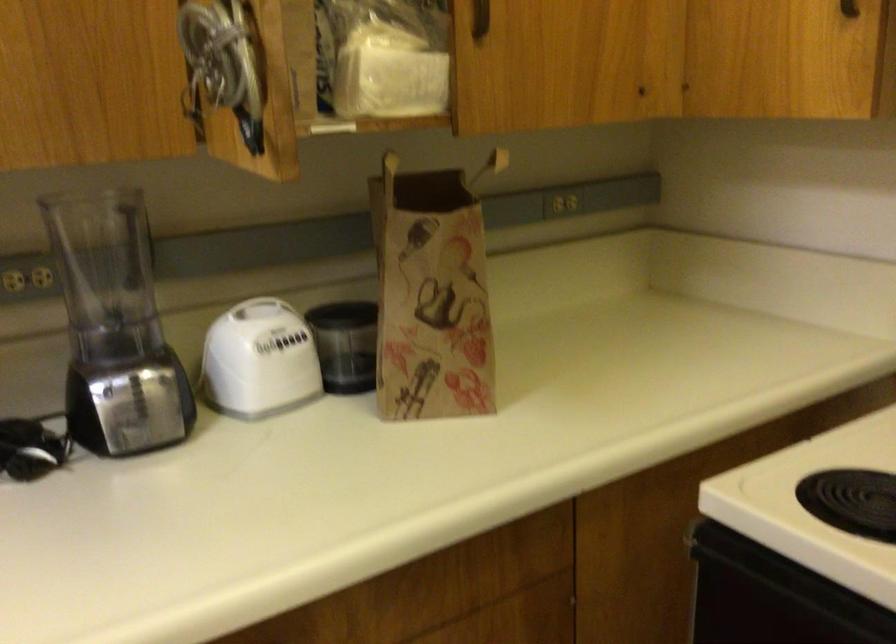
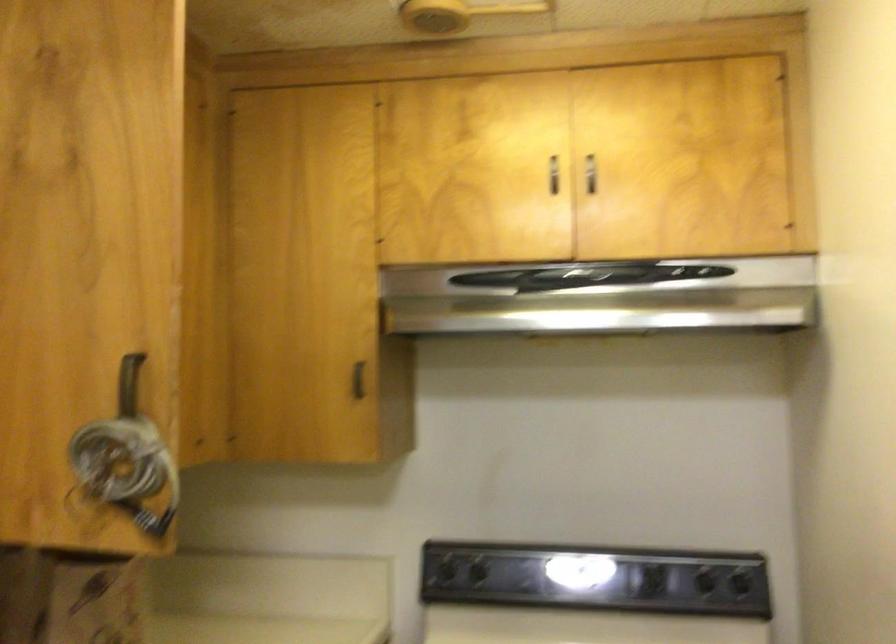
Locate, in the second image, the point that corresponds to (x=479, y=19) in the first image.

(116, 406)